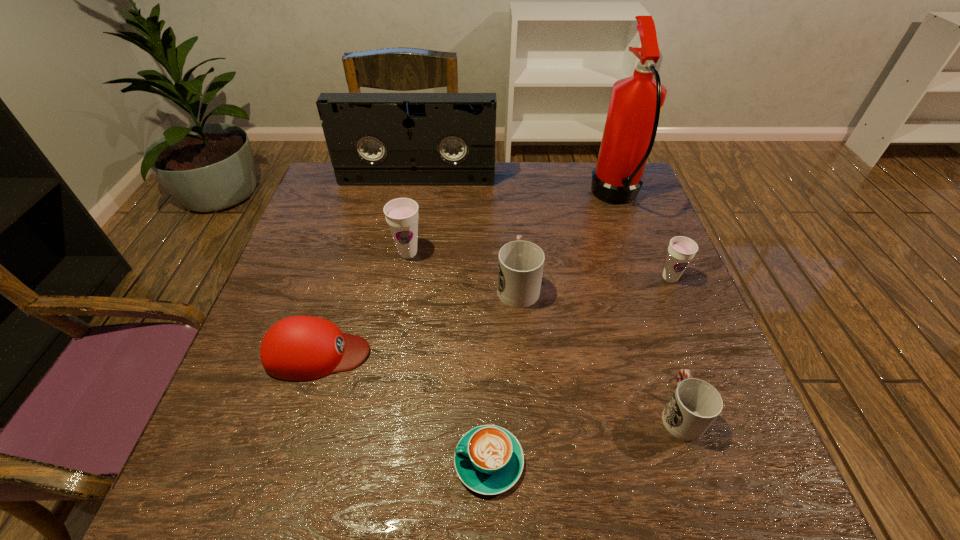
Where is `baseball cap`? The width and height of the screenshot is (960, 540). baseball cap is located at coordinates (299, 348).

Locate an element on the screen. the smaller red cup is located at coordinates (695, 404).

Locate an element on the screen. the right red cup is located at coordinates (695, 404).

Identify the location of the shortest object. pyautogui.click(x=489, y=460).

This screenshot has height=540, width=960. I want to click on cappuccino, so click(x=489, y=460).

You are a GUI agent. You are given a task and a screenshot of the screen. Output one action in this format:
    pyautogui.click(x=<x>, y=<y>)
    Task: Click on the vacant point located 0.070m at the spray nozzle of the tallest object
    
    Given the screenshot: What is the action you would take?
    pyautogui.click(x=567, y=197)

You are a GUI agent. You are given a task and a screenshot of the screen. Output one action in this format:
    pyautogui.click(x=<x>, y=<y>)
    Task: Click on the vacant space located 0.380m at the spray nozzle of the tallest object
    Image resolution: width=960 pixels, height=540 pixels.
    Given the screenshot: What is the action you would take?
    pyautogui.click(x=463, y=197)

Find the location of `vacant space positioned 0.140m at the spray nozzle of the tallest object`. vacant space positioned 0.140m at the spray nozzle of the tallest object is located at coordinates (543, 197).

I want to click on vacant space located 0.050m on the side of the second tallest object with visible spindles, so click(x=415, y=195).

Where is `vacant space located on the front of the third farthest object`? vacant space located on the front of the third farthest object is located at coordinates (396, 327).